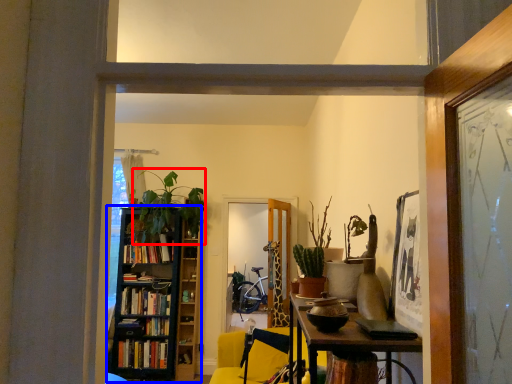
Question: Which of the following is the farthest to the observer, plant (highlighted by a red box) or bookcase (highlighted by a blue box)?

Choices:
 (A) plant
 (B) bookcase

Answer: (B)